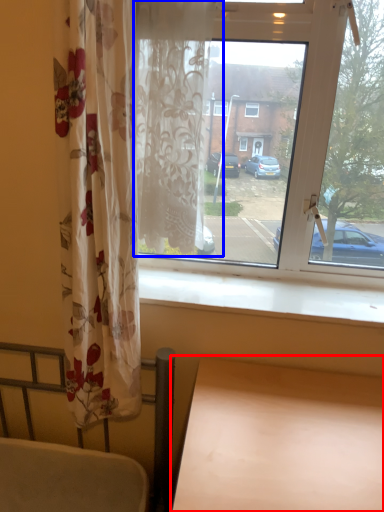
Question: Among these objects, which one is farthest to the camera, table (highlighted by a red box) or curtain (highlighted by a blue box)?

Choices:
 (A) table
 (B) curtain

Answer: (B)